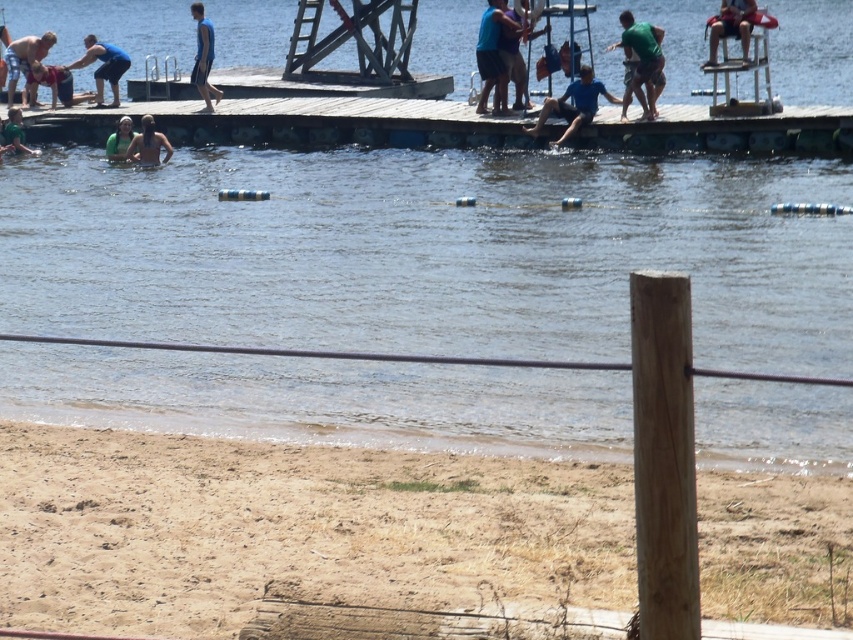
Does green fabric swimsuit at lower left appear on the left side of green fabric swimmer at upper left?

Yes, green fabric swimsuit at lower left is to the left of green fabric swimmer at upper left.

Can you confirm if green fabric swimsuit at lower left is smaller than green fabric swimmer at upper left?

No, green fabric swimsuit at lower left is not smaller than green fabric swimmer at upper left.

Describe the element at coordinates (15, 132) in the screenshot. I see `green fabric swimsuit at lower left` at that location.

Locate an element on the screen. green fabric swimsuit at lower left is located at coordinates click(x=15, y=132).

Looking at this image, is light brown sand at lower left thinner than blue fabric shirt at upper left?

No.

Is light brown sand at lower left below blue fabric shirt at upper left?

Indeed, light brown sand at lower left is positioned under blue fabric shirt at upper left.

The height and width of the screenshot is (640, 853). What do you see at coordinates (291, 531) in the screenshot?
I see `light brown sand at lower left` at bounding box center [291, 531].

Locate an element on the screen. This screenshot has width=853, height=640. light brown sand at lower left is located at coordinates (291, 531).

Is green matte shirt at upper center below matte blue shorts at left?

Yes, green matte shirt at upper center is below matte blue shorts at left.

Is green matte shirt at upper center shorter than matte blue shorts at left?

Correct, green matte shirt at upper center is not as tall as matte blue shorts at left.

What are the coordinates of `green matte shirt at upper center` in the screenshot? It's located at (641, 64).